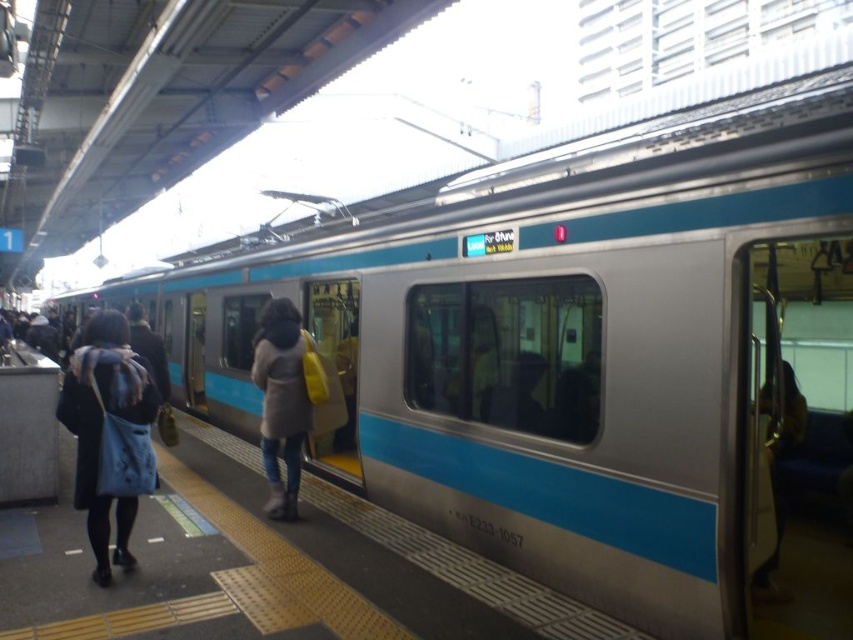
Is black fabric coat at left positioned before light brown leather coat at center?

Yes, black fabric coat at left is in front of light brown leather coat at center.

How much distance is there between black fabric coat at left and light brown leather coat at center?

black fabric coat at left and light brown leather coat at center are 1.37 meters apart from each other.

Between point (113, 552) and point (262, 346), which one is positioned in front?

Point (113, 552)

The width and height of the screenshot is (853, 640). In order to click on black fabric coat at left in this screenshot , I will do pos(102,426).